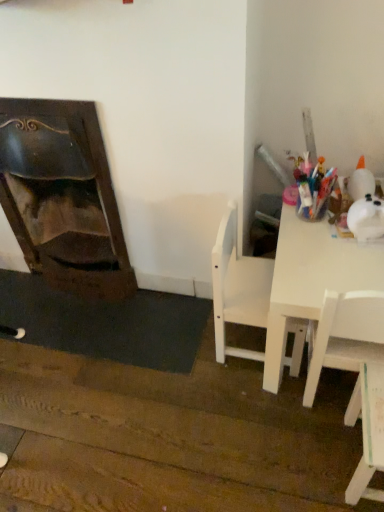
Locate an element on the screen. free spot to the left of white matte chair at lower right, positioned as the 2th chair in left-to-right order is located at coordinates (295, 457).